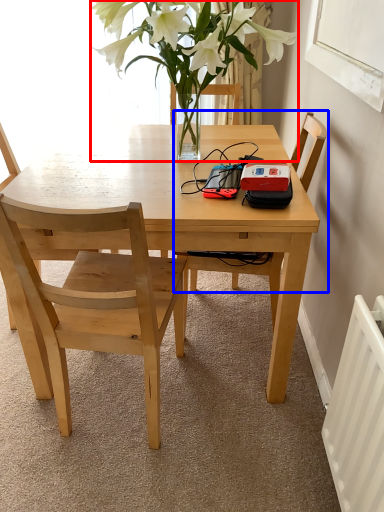
Question: Among these objects, which one is farthest to the camera, houseplant (highlighted by a red box) or chair (highlighted by a blue box)?

Choices:
 (A) houseplant
 (B) chair

Answer: (B)